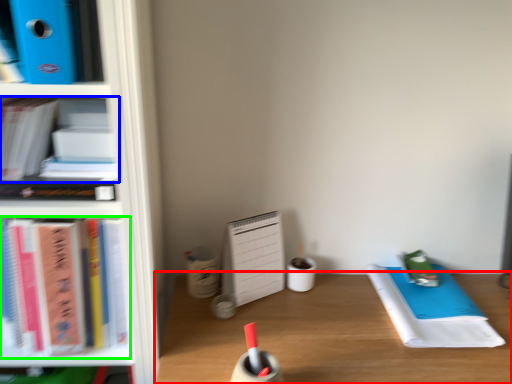
Question: Estimate the real-world distances between objects in this image. Which object is farther from desk (highlighted by a red box), book (highlighted by a blue box) or book (highlighted by a green box)?

Choices:
 (A) book
 (B) book

Answer: (A)